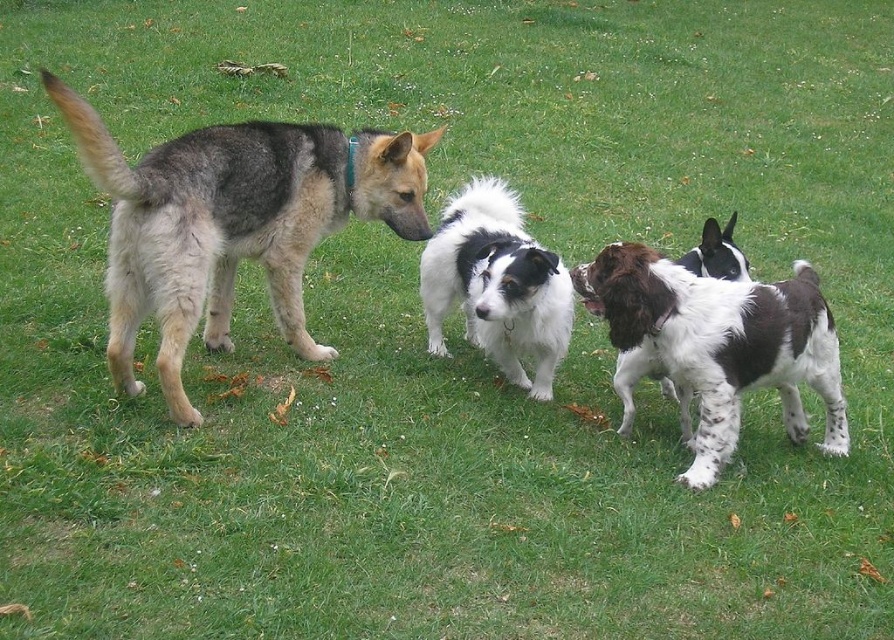
You are a photographer trying to capture a photo of the spotted fur dog at center and the white speckled fur dog at center. Based on their positions, which dog should you focus on first to ensure both are in frame?

The spotted fur dog at center is located above the white speckled fur dog at center, so you should focus on the spotted fur dog at center first to ensure both are in frame.